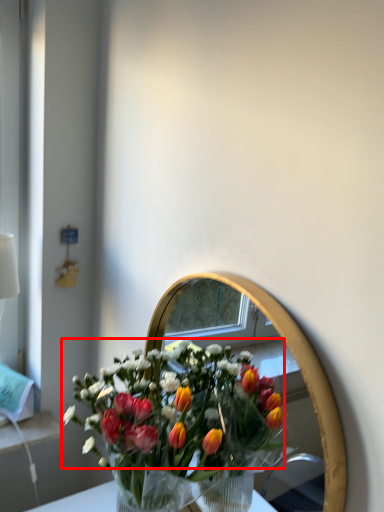
Question: Where is flower (annotated by the red box) located in relation to mirror in the image?

Choices:
 (A) left
 (B) right

Answer: (A)